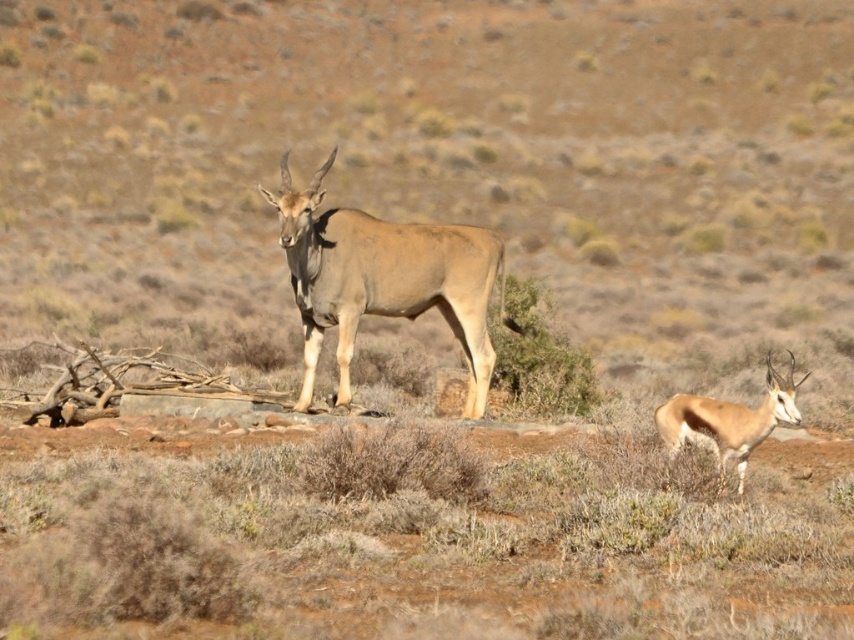
You are a photographer trying to capture a closeup shot of the smooth brown antelope at lower right. You have a lens that can focus on objects up to 1 meter thick. The green leafy bush at center is blocking your view. Can you adjust your position to take the photo without moving the bush?

The green leafy bush at center is thinner than the smooth brown antelope at lower right. Since the bush is thinner than 1 meter, your lens can focus through it to capture the antelope.

You are a hiker trying to navigate through the dry landscape. You see the green leafy bush at center and the smooth brown antelope at lower right. Which object is smaller in size?

The green leafy bush at center is smaller than the smooth brown antelope at lower right.

You are standing at the origin point in the center of the image. Which of the two points, point (x=347, y=212) or point (x=518, y=384), is closer to you?

Point (x=347, y=212) is closer to you because it is in front of point (x=518, y=384).